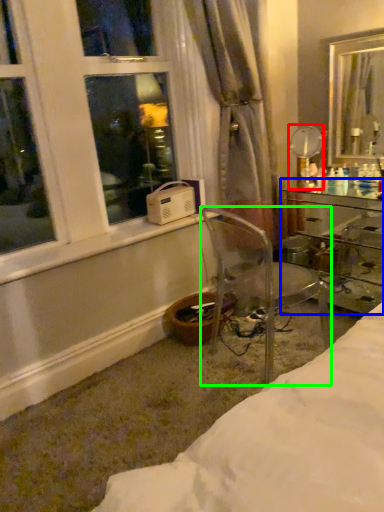
Question: Considering the real-world distances, which object is farthest from mirror (highlighted by a red box)? desk (highlighted by a blue box) or chair (highlighted by a green box)?

Choices:
 (A) desk
 (B) chair

Answer: (B)